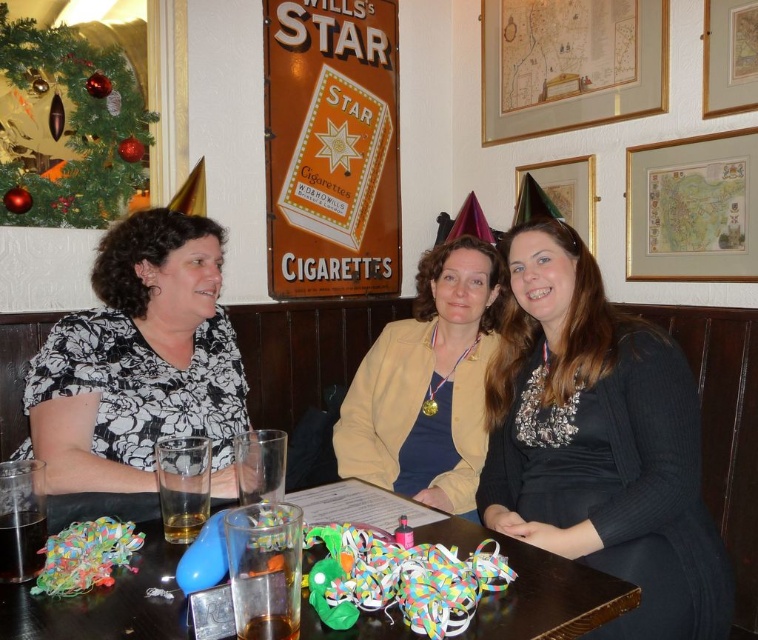
Between black floral blouse at left and translucent plastic cups at center, which one is positioned lower?

translucent plastic cups at center is below.

At what (x,y) coordinates should I click in order to perform the action: click on black floral blouse at left. Please return your answer as a coordinate pair (x, y). Looking at the image, I should click on (139, 362).

Identify the location of black floral blouse at left. (139, 362).

Does black ribbed sweater at center come behind translucent plastic cups at center?

Yes, it is behind translucent plastic cups at center.

Between point (512, 384) and point (528, 605), which one is positioned behind?

Positioned behind is point (512, 384).

Identify the location of black ribbed sweater at center. (600, 442).

Between point (188, 228) and point (39, 513), which one is positioned in front?

Point (39, 513) is in front.

The width and height of the screenshot is (758, 640). I want to click on black floral blouse at left, so click(x=139, y=362).

In order to click on black floral blouse at left in this screenshot , I will do `click(139, 362)`.